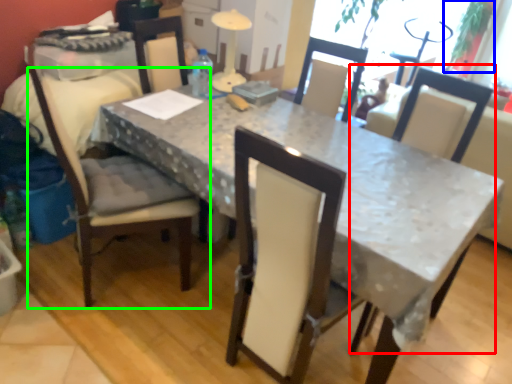
Question: Based on their relative distances, which object is nearer to chair (highlighted by a red box)? Choose from plant (highlighted by a blue box) and chair (highlighted by a green box).

Choices:
 (A) plant
 (B) chair

Answer: (B)